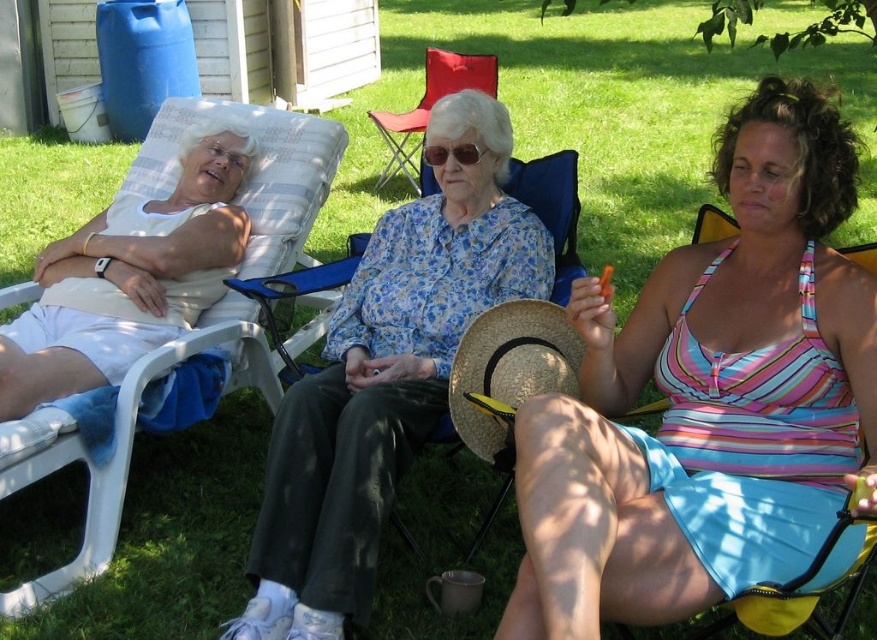
Is floral fabric blouse at center bigger than white matte tank top at left?

Correct, floral fabric blouse at center is larger in size than white matte tank top at left.

Does point (353, 534) come behind point (13, 385)?

No, (353, 534) is in front of (13, 385).

Who is more forward, (446, 369) or (215, 218)?

Point (446, 369) is more forward.

This screenshot has height=640, width=877. Find the location of `floral fabric blouse at center`. floral fabric blouse at center is located at coordinates (386, 376).

What do you see at coordinates (709, 397) in the screenshot?
I see `striped fabric tank top at center` at bounding box center [709, 397].

Can you confirm if striped fabric tank top at center is bigger than strawtexturehat at center?

Correct, striped fabric tank top at center is larger in size than strawtexturehat at center.

Who is more forward, (x=593, y=596) or (x=498, y=321)?

Positioned in front is point (x=593, y=596).

The width and height of the screenshot is (877, 640). In order to click on striped fabric tank top at center in this screenshot , I will do (x=709, y=397).

How much distance is there between floral fabric blouse at center and strawtexturehat at center?

floral fabric blouse at center and strawtexturehat at center are 11.64 inches apart.

Is point (397, 276) closer to camera compared to point (476, 412)?

That is False.

This screenshot has height=640, width=877. In order to click on floral fabric blouse at center in this screenshot , I will do `click(386, 376)`.